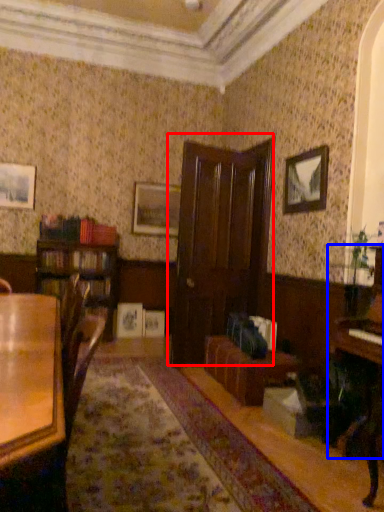
Question: Which point is further to the camera, door (highlighted by a red box) or piano (highlighted by a blue box)?

Choices:
 (A) door
 (B) piano

Answer: (A)